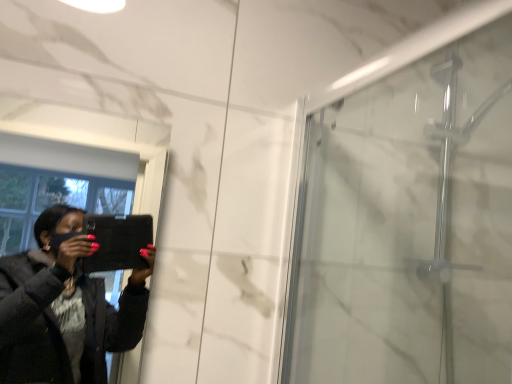
Question: Is matte black tablet at left located within transparent glass shower door at right?

Choices:
 (A) yes
 (B) no

Answer: (B)

Question: Considering the relative positions of transparent glass shower door at right and matte black tablet at left in the image provided, is transparent glass shower door at right in front of matte black tablet at left?

Choices:
 (A) no
 (B) yes

Answer: (A)

Question: Is transparent glass shower door at right taller than matte black tablet at left?

Choices:
 (A) no
 (B) yes

Answer: (B)

Question: Can you confirm if transparent glass shower door at right is shorter than matte black tablet at left?

Choices:
 (A) yes
 (B) no

Answer: (B)

Question: From a real-world perspective, is transparent glass shower door at right on matte black tablet at left?

Choices:
 (A) no
 (B) yes

Answer: (B)

Question: Can you confirm if transparent glass shower door at right is wider than matte black tablet at left?

Choices:
 (A) no
 (B) yes

Answer: (B)

Question: Is matte black tablet at left to the right of transparent glass shower door at right from the viewer's perspective?

Choices:
 (A) no
 (B) yes

Answer: (A)

Question: Is matte black tablet at left bigger than transparent glass shower door at right?

Choices:
 (A) no
 (B) yes

Answer: (A)

Question: From the image's perspective, would you say matte black tablet at left is shown under transparent glass shower door at right?

Choices:
 (A) yes
 (B) no

Answer: (A)

Question: From the image's perspective, is matte black tablet at left over transparent glass shower door at right?

Choices:
 (A) no
 (B) yes

Answer: (A)

Question: Does matte black tablet at left have a greater width compared to transparent glass shower door at right?

Choices:
 (A) yes
 (B) no

Answer: (B)

Question: Can transparent glass shower door at right be found inside matte black tablet at left?

Choices:
 (A) yes
 (B) no

Answer: (B)

Question: Considering their positions, is matte black tablet at left located in front of or behind transparent glass shower door at right?

Choices:
 (A) front
 (B) behind

Answer: (A)